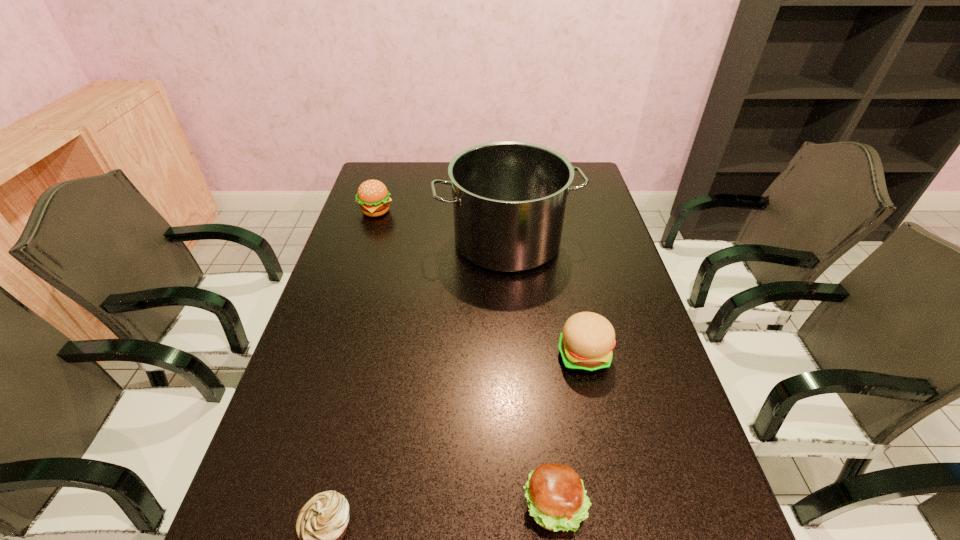
The height and width of the screenshot is (540, 960). In order to click on the tallest object in this screenshot , I will do `click(509, 198)`.

Where is `the leftmost hamburger`? Image resolution: width=960 pixels, height=540 pixels. the leftmost hamburger is located at coordinates (373, 197).

This screenshot has height=540, width=960. I want to click on the third nearest object, so click(x=586, y=343).

Where is `vacant point located 0.080m on the left of the tallest object`? vacant point located 0.080m on the left of the tallest object is located at coordinates (411, 241).

I want to click on free region located on the right of the farthest hamburger, so click(471, 211).

Find the location of a particular element. The width and height of the screenshot is (960, 540). free space located on the back of the second farthest hamburger is located at coordinates (561, 249).

The image size is (960, 540). Identify the location of object that is at the left edge. (373, 197).

Where is `saucepan that is at the right edge`? This screenshot has height=540, width=960. saucepan that is at the right edge is located at coordinates (509, 198).

Image resolution: width=960 pixels, height=540 pixels. Find the location of `hamburger situated at the right edge`. hamburger situated at the right edge is located at coordinates (586, 343).

Identify the location of free space at the left edge. pyautogui.click(x=344, y=251).